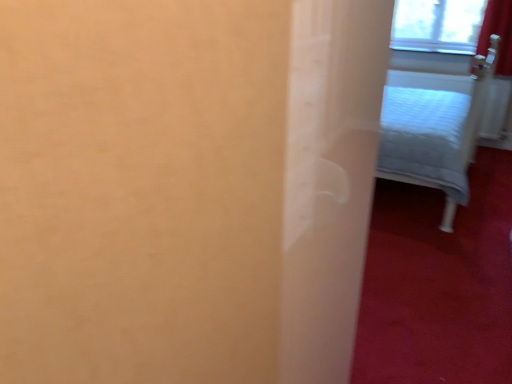
Question: Is transparent glass window at upper right shorter than light gray fabric bed at upper right?

Choices:
 (A) yes
 (B) no

Answer: (A)

Question: Considering the relative sizes of transparent glass window at upper right and light gray fabric bed at upper right in the image provided, is transparent glass window at upper right smaller than light gray fabric bed at upper right?

Choices:
 (A) no
 (B) yes

Answer: (B)

Question: Is transparent glass window at upper right with light gray fabric bed at upper right?

Choices:
 (A) no
 (B) yes

Answer: (A)

Question: Considering the relative sizes of transparent glass window at upper right and light gray fabric bed at upper right in the image provided, is transparent glass window at upper right bigger than light gray fabric bed at upper right?

Choices:
 (A) no
 (B) yes

Answer: (A)

Question: Can you confirm if transparent glass window at upper right is taller than light gray fabric bed at upper right?

Choices:
 (A) no
 (B) yes

Answer: (A)

Question: From the image's perspective, is transparent glass window at upper right under light gray fabric bed at upper right?

Choices:
 (A) yes
 (B) no

Answer: (B)

Question: Does light gray fabric bed at upper right lie in front of transparent glass window at upper right?

Choices:
 (A) yes
 (B) no

Answer: (A)

Question: From a real-world perspective, is light gray fabric bed at upper right located beneath transparent glass window at upper right?

Choices:
 (A) no
 (B) yes

Answer: (B)

Question: Can you confirm if light gray fabric bed at upper right is positioned to the right of transparent glass window at upper right?

Choices:
 (A) yes
 (B) no

Answer: (B)

Question: Is light gray fabric bed at upper right next to transparent glass window at upper right and touching it?

Choices:
 (A) no
 (B) yes

Answer: (A)

Question: Is light gray fabric bed at upper right positioned far away from transparent glass window at upper right?

Choices:
 (A) yes
 (B) no

Answer: (A)

Question: Is light gray fabric bed at upper right taller than transparent glass window at upper right?

Choices:
 (A) yes
 (B) no

Answer: (A)

Question: Does point (417, 29) appear closer or farther from the camera than point (437, 140)?

Choices:
 (A) farther
 (B) closer

Answer: (A)